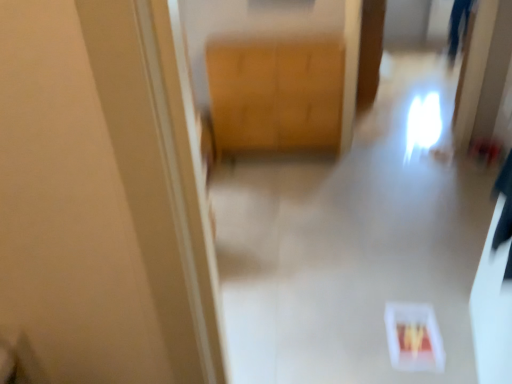
I want to click on empty space that is ontop of white plastic container at lower center, so click(x=370, y=210).